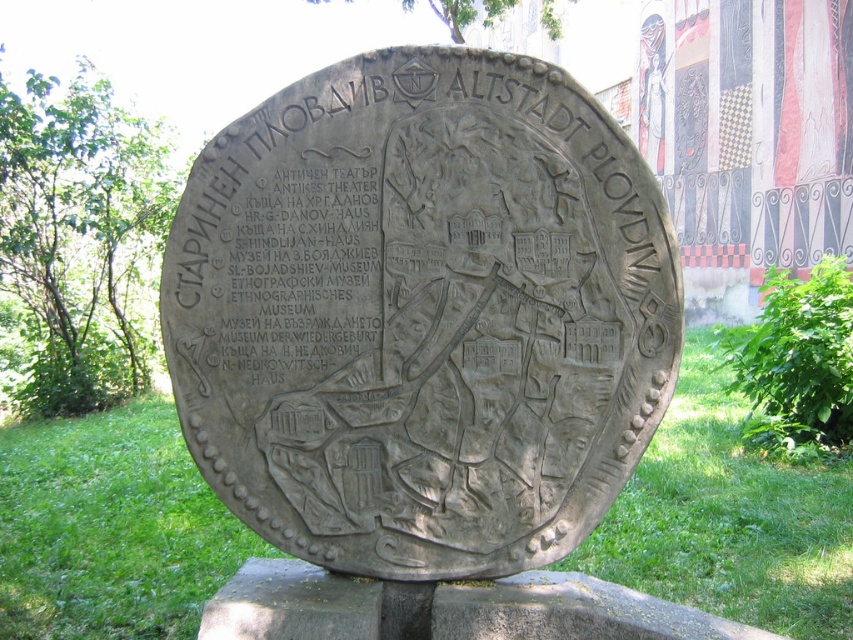
Question: Which point is closer to the camera?

Choices:
 (A) gray stone plaque at center
 (B) green grass at lower center

Answer: (A)

Question: Among these objects, which one is farthest from the camera?

Choices:
 (A) gray stone plaque at center
 (B) green grass at lower center

Answer: (B)

Question: Observing the image, what is the correct spatial positioning of gray stone plaque at center in reference to green grass at lower center?

Choices:
 (A) below
 (B) above

Answer: (B)

Question: Can you confirm if gray stone plaque at center is positioned above green grass at lower center?

Choices:
 (A) yes
 (B) no

Answer: (A)

Question: Can you confirm if gray stone plaque at center is positioned below green grass at lower center?

Choices:
 (A) no
 (B) yes

Answer: (A)